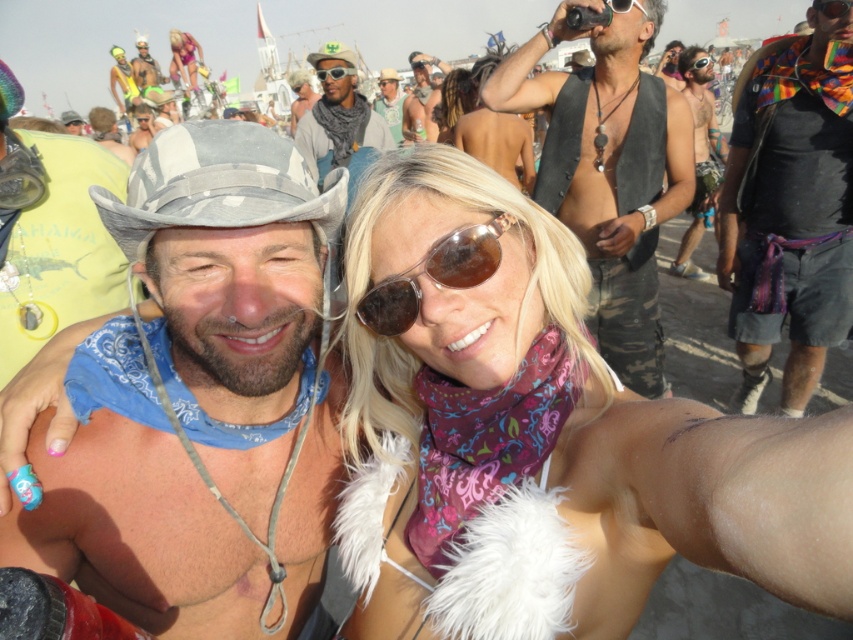
Question: Does matte black cowboy hat at upper left have a smaller size compared to clear plastic goggles at upper center?

Choices:
 (A) no
 (B) yes

Answer: (A)

Question: Which object is farther from the camera taking this photo?

Choices:
 (A) camouflage fabric hat at center
 (B) sunglasses at center
 (C) black plastic goggles at upper center
 (D) blonde hair at center

Answer: (D)

Question: Among these points, which one is nearest to the camera?

Choices:
 (A) (386, 108)
 (B) (471, 76)
 (C) (695, 61)
 (D) (323, 60)

Answer: (D)

Question: Does sunglasses at center have a lesser width compared to clear plastic goggles at upper center?

Choices:
 (A) no
 (B) yes

Answer: (B)

Question: Can you confirm if leather vest at upper center is positioned to the left of black plastic goggles at upper center?

Choices:
 (A) no
 (B) yes

Answer: (B)

Question: Which point appears closest to the camera in this image?

Choices:
 (A) (328, 54)
 (B) (715, 150)

Answer: (A)